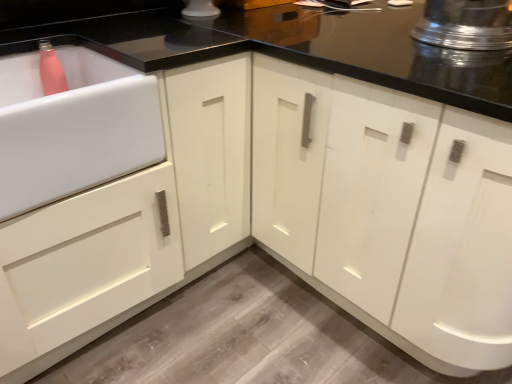
The height and width of the screenshot is (384, 512). Identify the location of shiny metallic pot at upper right. (466, 24).

Describe the element at coordinates (466, 24) in the screenshot. The image size is (512, 384). I see `shiny metallic pot at upper right` at that location.

Describe the element at coordinates (73, 128) in the screenshot. I see `white glossy sink at left` at that location.

Where is `white glossy sink at left`? white glossy sink at left is located at coordinates (73, 128).

What do you see at coordinates (391, 211) in the screenshot? The image size is (512, 384). I see `white glossy cabinet at center` at bounding box center [391, 211].

Identify the location of shiny metallic pot at upper right. (466, 24).

Could you tell me if white glossy sink at left is facing shiny metallic pot at upper right?

No, white glossy sink at left is not facing towards shiny metallic pot at upper right.

From the image's perspective, which one is positioned higher, white glossy sink at left or shiny metallic pot at upper right?

shiny metallic pot at upper right, from the image's perspective.

Is white glossy sink at left next to shiny metallic pot at upper right and touching it?

white glossy sink at left and shiny metallic pot at upper right are not in contact.

Between white glossy sink at left and shiny metallic pot at upper right, which one has more height?

With more height is white glossy sink at left.

Is shiny metallic pot at upper right next to white glossy cabinet at center?

shiny metallic pot at upper right and white glossy cabinet at center are clearly separated.

From a real-world perspective, relative to white glossy cabinet at center, is shiny metallic pot at upper right vertically above or below?

shiny metallic pot at upper right is above white glossy cabinet at center.

Which object is wider, shiny metallic pot at upper right or white glossy cabinet at center?

Wider between the two is white glossy cabinet at center.

Considering the sizes of objects shiny metallic pot at upper right and white glossy cabinet at center in the image provided, who is smaller, shiny metallic pot at upper right or white glossy cabinet at center?

shiny metallic pot at upper right.

Consider the image. Which object is wider, shiny metallic pot at upper right or white glossy sink at left?

Wider between the two is shiny metallic pot at upper right.

From the image's perspective, would you say shiny metallic pot at upper right is positioned over white glossy sink at left?

Indeed, from the image's perspective, shiny metallic pot at upper right is shown above white glossy sink at left.

Is shiny metallic pot at upper right at the right side of white glossy sink at left?

Indeed, shiny metallic pot at upper right is positioned on the right side of white glossy sink at left.

Considering the sizes of shiny metallic pot at upper right and white glossy sink at left in the image, is shiny metallic pot at upper right bigger or smaller than white glossy sink at left?

In the image, shiny metallic pot at upper right appears to be smaller than white glossy sink at left.

Is the surface of white glossy cabinet at center in direct contact with white glossy sink at left?

No, white glossy cabinet at center is not beside white glossy sink at left.

Considering the sizes of objects white glossy cabinet at center and white glossy sink at left in the image provided, who is taller, white glossy cabinet at center or white glossy sink at left?

With more height is white glossy cabinet at center.

Consider the image. In terms of width, does white glossy cabinet at center look wider or thinner when compared to white glossy sink at left?

Clearly, white glossy cabinet at center has more width compared to white glossy sink at left.

From a real-world perspective, does white glossy cabinet at center stand above white glossy sink at left?

Actually, white glossy cabinet at center is physically below white glossy sink at left in the real world.

Would you say white glossy sink at left is outside white glossy cabinet at center?

Yes, white glossy sink at left is not within white glossy cabinet at center.

From the image's perspective, which one is positioned higher, white glossy sink at left or white glossy cabinet at center?

white glossy cabinet at center is shown above in the image.

Is the depth of white glossy sink at left greater than that of white glossy cabinet at center?

Yes, it is.

Considering the points (369, 279) and (505, 21), which point is behind, point (369, 279) or point (505, 21)?

The point (369, 279) is behind.

Considering the positions of objects white glossy cabinet at center and shiny metallic pot at upper right in the image provided, who is more to the left, white glossy cabinet at center or shiny metallic pot at upper right?

Positioned to the left is white glossy cabinet at center.

Is shiny metallic pot at upper right at the back of white glossy cabinet at center?

That's not correct — white glossy cabinet at center is not looking away from shiny metallic pot at upper right.

Locate an element on the screen. appliance above the white glossy sink at left (from a real-world perspective) is located at coordinates (466, 24).

Where is `cabinetry directly beneath the shiny metallic pot at upper right (from a real-world perspective)`? The width and height of the screenshot is (512, 384). cabinetry directly beneath the shiny metallic pot at upper right (from a real-world perspective) is located at coordinates [391, 211].

From the image, which object appears to be nearer to white glossy sink at left, shiny metallic pot at upper right or white glossy cabinet at center?

Based on the image, white glossy cabinet at center appears to be nearer to white glossy sink at left.

Which object lies further to the anchor point shiny metallic pot at upper right, white glossy cabinet at center or white glossy sink at left?

white glossy sink at left lies further to shiny metallic pot at upper right than the other object.

Looking at the image, which one is located further to white glossy cabinet at center, shiny metallic pot at upper right or white glossy sink at left?

The object further to white glossy cabinet at center is white glossy sink at left.

Considering their positions, is white glossy sink at left positioned further to shiny metallic pot at upper right than white glossy cabinet at center?

Among the two, white glossy sink at left is located further to shiny metallic pot at upper right.

Looking at the image, which one is located further to white glossy cabinet at center, white glossy sink at left or shiny metallic pot at upper right?

white glossy sink at left is positioned further to the anchor white glossy cabinet at center.

Considering their positions, is white glossy cabinet at center positioned closer to white glossy sink at left than shiny metallic pot at upper right?

white glossy cabinet at center lies closer to white glossy sink at left than the other object.

Find the location of a particular element. This screenshot has width=512, height=384. cabinetry between white glossy sink at left and shiny metallic pot at upper right is located at coordinates (391, 211).